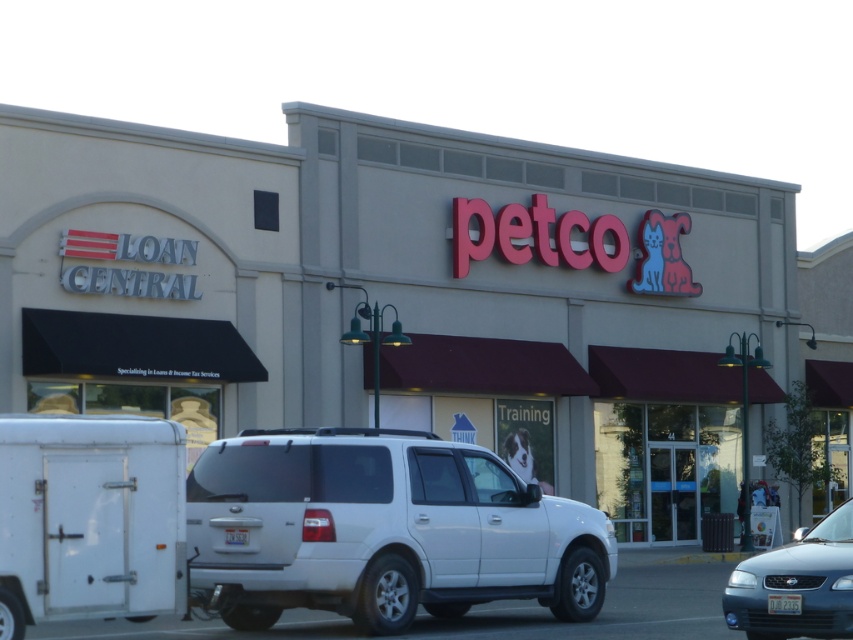
Question: Based on their relative distances, which object is farther from the metallic blue sedan at lower right?

Choices:
 (A) white matte trailer at lower left
 (B) white matte minivan at center

Answer: (A)

Question: Does white matte minivan at center come behind metallic blue sedan at lower right?

Choices:
 (A) yes
 (B) no

Answer: (A)

Question: Does white matte minivan at center appear on the right side of metallic blue sedan at lower right?

Choices:
 (A) no
 (B) yes

Answer: (A)

Question: Which is farther from the white matte trailer at lower left?

Choices:
 (A) metallic blue sedan at lower right
 (B) white matte minivan at center

Answer: (A)

Question: Is white matte minivan at center to the right of white matte trailer at lower left from the viewer's perspective?

Choices:
 (A) yes
 (B) no

Answer: (A)

Question: Which point is farther from the camera taking this photo?

Choices:
 (A) (592, 518)
 (B) (734, 620)
 (C) (18, 420)

Answer: (A)